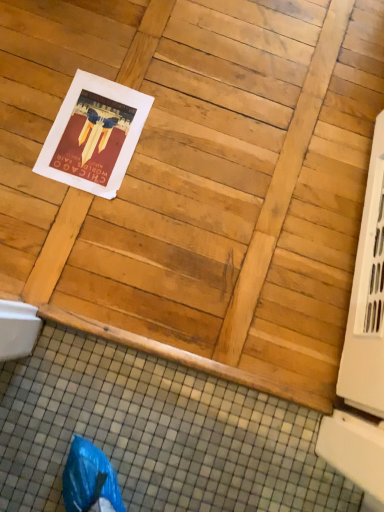
You are a GUI agent. You are given a task and a screenshot of the screen. Output one action in this format:
    pyautogui.click(x=<x>, y=<y>)
    Task: Click on the vacant region above white paper poster at upper left (from a real-world perspective)
    
    Given the screenshot: What is the action you would take?
    pyautogui.click(x=94, y=132)